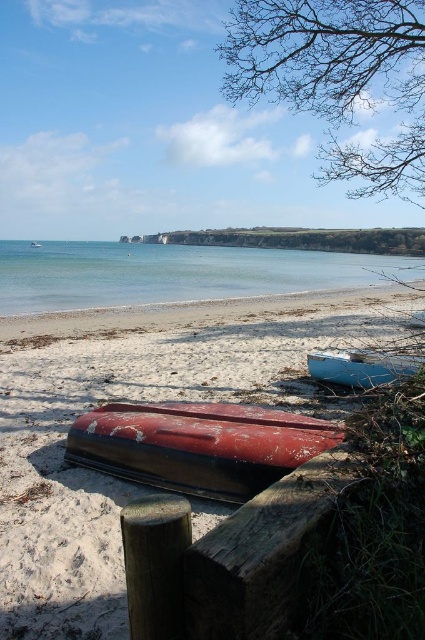
Measure the distance between bare branches at upper right and clear blue water at center.

A distance of 41.02 feet exists between bare branches at upper right and clear blue water at center.

Is point (346, 29) less distant than point (272, 289)?

Yes.

Where is `bare branches at upper right`? This screenshot has width=425, height=640. bare branches at upper right is located at coordinates (339, 77).

Identify the location of smooth sand at lower center. (139, 401).

Can you confirm if smooth sand at lower center is positioned to the left of clear blue water at center?

No, smooth sand at lower center is not to the left of clear blue water at center.

The width and height of the screenshot is (425, 640). What do you see at coordinates (139, 401) in the screenshot? I see `smooth sand at lower center` at bounding box center [139, 401].

Image resolution: width=425 pixels, height=640 pixels. I want to click on smooth sand at lower center, so click(139, 401).

Measure the distance from smooth sand at lower center to light blue wooden boat at center.

They are 7.42 feet apart.

Is smooth sand at lower center behind light blue wooden boat at center?

No, smooth sand at lower center is closer to the viewer.

Image resolution: width=425 pixels, height=640 pixels. In order to click on smooth sand at lower center in this screenshot , I will do `click(139, 401)`.